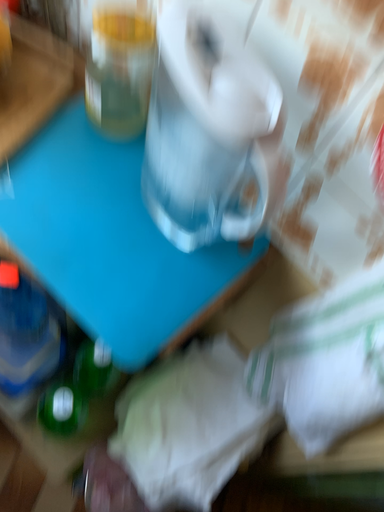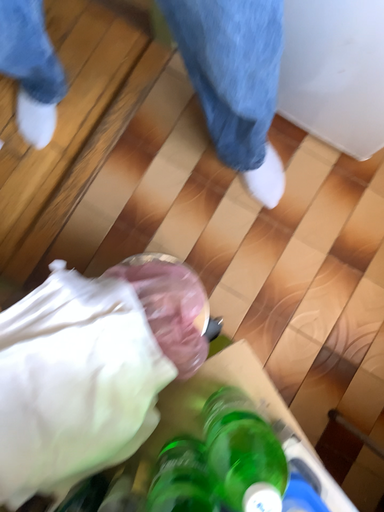
Question: How did the camera likely rotate when shooting the video?

Choices:
 (A) rotated right
 (B) rotated left

Answer: (A)